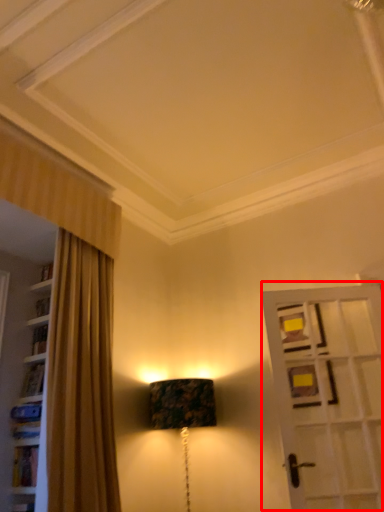
Question: From the image, what is the correct spatial relationship of door (annotated by the red box) in relation to table lamp?

Choices:
 (A) right
 (B) left

Answer: (A)